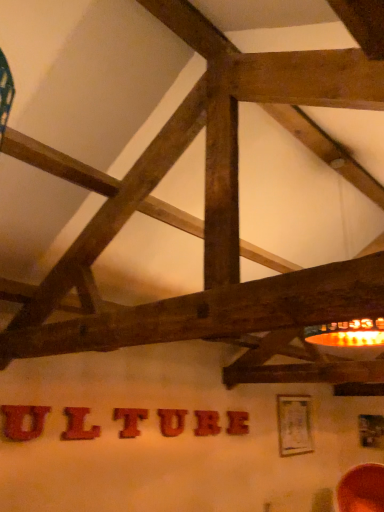
Question: In which direction should I rotate to look at wooden letter at center, which is the sixth letter in left-to-right order?

Choices:
 (A) right
 (B) left

Answer: (A)

Question: Is wooden letter t at center, the 3th letter viewed from the left, to the left of wooden letter at center, arranged as the second letter when viewed from the back, from the viewer's perspective?

Choices:
 (A) no
 (B) yes

Answer: (B)

Question: From a real-world perspective, is wooden letter t at center, the 3th letter viewed from the left, physically below wooden letter at center, arranged as the second letter when viewed from the back?

Choices:
 (A) no
 (B) yes

Answer: (A)

Question: Would you say wooden letter t at center, which ranks as the fourth letter in right-to-left order, is outside wooden letter at center, the second letter in the right-to-left sequence?

Choices:
 (A) no
 (B) yes

Answer: (B)

Question: Is wooden letter t at center, which is the third letter from front to back, with wooden letter at center, acting as the fifth letter starting from the front?

Choices:
 (A) no
 (B) yes

Answer: (A)

Question: Could you tell me if wooden letter t at center, the 3th letter viewed from the left, is facing wooden letter at center, the fifth letter when ordered from left to right?

Choices:
 (A) no
 (B) yes

Answer: (A)

Question: Is the depth of wooden letter t at center, which is the third letter from front to back, less than that of wooden letter at center, the second letter in the right-to-left sequence?

Choices:
 (A) yes
 (B) no

Answer: (A)

Question: From the image's perspective, would you say wooden letter at center, acting as the fifth letter starting from the front, is shown under brushed wood letter at center, which is the 6th letter from back to front?

Choices:
 (A) yes
 (B) no

Answer: (A)

Question: Considering the relative sizes of wooden letter at center, the second letter in the right-to-left sequence, and brushed wood letter at center, which is counted as the 6th letter, starting from the right, in the image provided, is wooden letter at center, the second letter in the right-to-left sequence, smaller than brushed wood letter at center, which is counted as the 6th letter, starting from the right,?

Choices:
 (A) no
 (B) yes

Answer: (A)

Question: Considering the relative sizes of wooden letter at center, the fifth letter when ordered from left to right, and brushed wood letter at center, which is the 6th letter from back to front, in the image provided, is wooden letter at center, the fifth letter when ordered from left to right, thinner than brushed wood letter at center, which is the 6th letter from back to front,?

Choices:
 (A) yes
 (B) no

Answer: (B)

Question: Does wooden letter at center, acting as the fifth letter starting from the front, have a greater height compared to brushed wood letter at center, which is the 6th letter from back to front?

Choices:
 (A) no
 (B) yes

Answer: (B)

Question: Is wooden letter at center, acting as the fifth letter starting from the front, to the right of brushed wood letter at center, which is counted as the 6th letter, starting from the right, from the viewer's perspective?

Choices:
 (A) yes
 (B) no

Answer: (A)

Question: From the image's perspective, is wooden letter at center, acting as the fifth letter starting from the front, on top of brushed wood letter at center, which is counted as the 6th letter, starting from the right?

Choices:
 (A) yes
 (B) no

Answer: (B)

Question: From a real-world perspective, is wooden letter at center, the 3th letter in the right-to-left sequence, under wooden letter at center, which ranks as the 1th letter in right-to-left order?

Choices:
 (A) no
 (B) yes

Answer: (A)